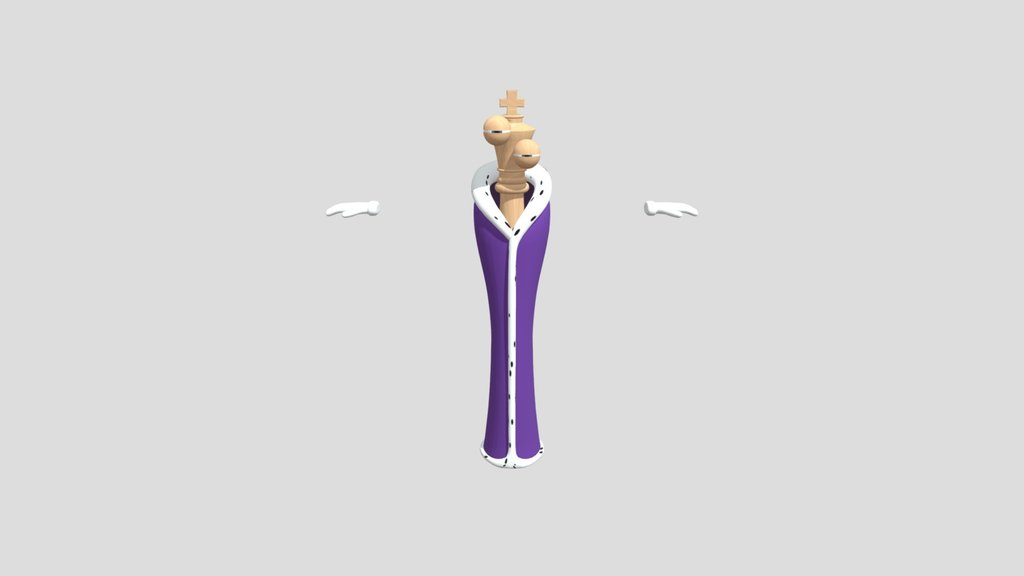
At what (x,y) coordinates should I click in order to perform the action: click on robe. Please return your answer as a coordinate pair (x, y). This screenshot has height=576, width=1024. Looking at the image, I should click on (495, 280).